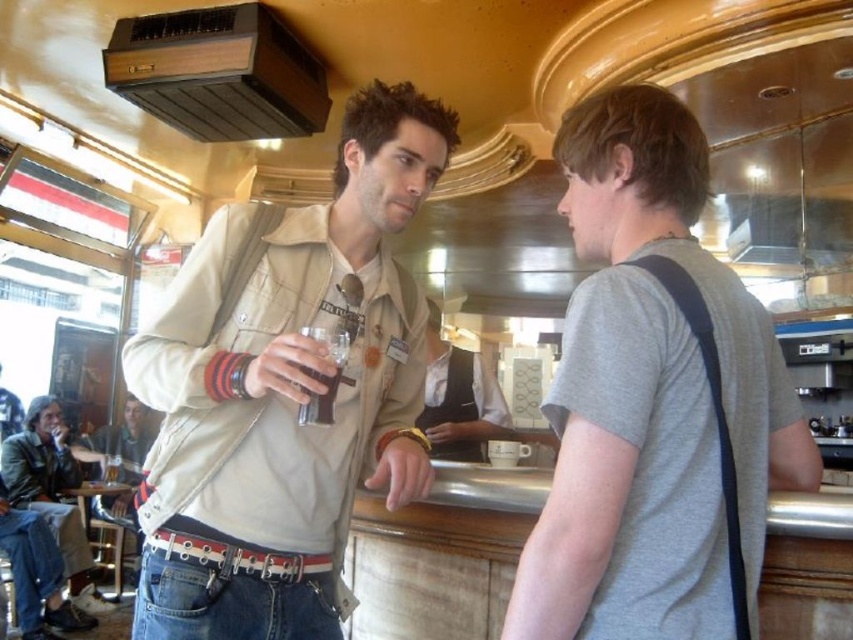
You are a photographer setting up a shoot in this diner scene. You need to ensure that the beige canvas jacket at center and the white uniform at center are both visible in the frame. Given their sizes, which object should you position closer to the camera to maintain their visibility without cropping?

The beige canvas jacket at center is smaller in size compared to the white uniform at center. To ensure both are visible without cropping, position the beige canvas jacket at center closer to the camera so its smaller size is compensated by proximity, while keeping the white uniform at center slightly farther back.